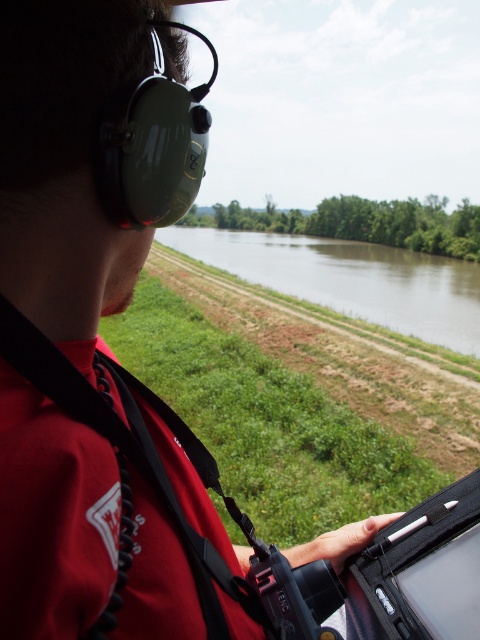
Does red fabric life jacket at lower left have a lesser width compared to brown muddy water at center?

A: Indeed, red fabric life jacket at lower left has a lesser width compared to brown muddy water at center.

Does point (79, 611) come farther from viewer compared to point (375, 266)?

No.

Image resolution: width=480 pixels, height=640 pixels. I want to click on red fabric life jacket at lower left, so click(122, 502).